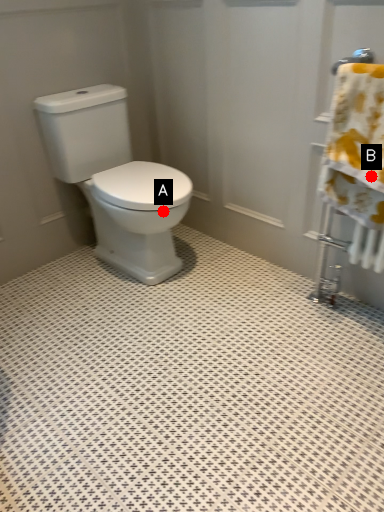
Question: Two points are circled on the image, labeled by A and B beside each circle. Which point appears closest to the camera in this image?

Choices:
 (A) A is closer
 (B) B is closer

Answer: (B)